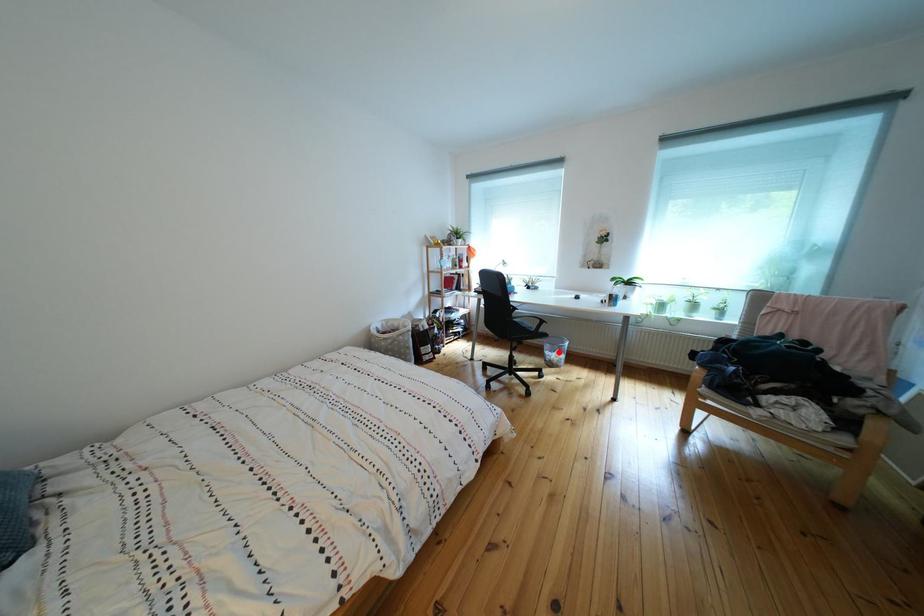
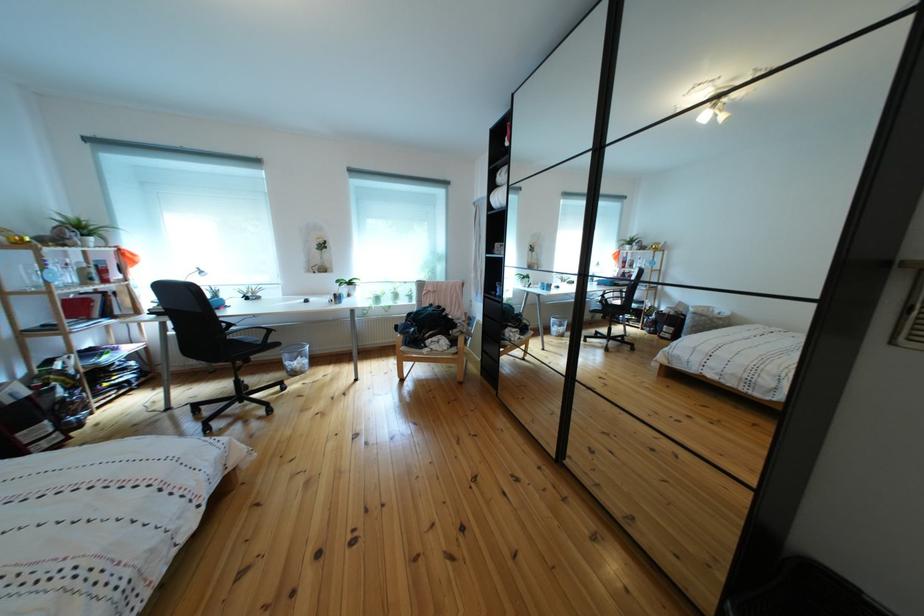
In the second image, find the point that corresponds to the highlighted location in the first image.

(297, 362)